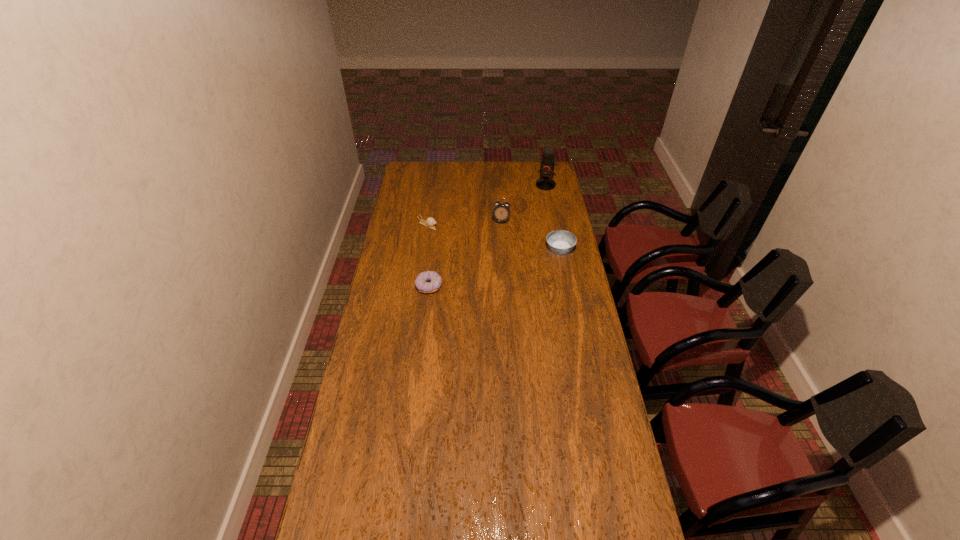
I want to click on vacant region located on the side of the farthest object with the red ring, so click(x=541, y=195).

At what (x,y) coordinates should I click in order to perform the action: click on vacant space situated 0.310m on the side of the farthest object with the red ring. Please return your answer as a coordinate pair (x, y). Looking at the image, I should click on (529, 221).

The width and height of the screenshot is (960, 540). I want to click on free spot located on the side of the farthest object with the red ring, so click(x=531, y=216).

What are the coordinates of `free point located 0.370m on the shell of the escargot` in the screenshot? It's located at (497, 255).

Find the location of `vacant area located on the shell of the escargot`. vacant area located on the shell of the escargot is located at coordinates (489, 251).

You are a GUI agent. You are given a task and a screenshot of the screen. Output one action in this format:
    pyautogui.click(x=<x>, y=<y>)
    Task: Click on the vacant space located on the shell of the escargot
    This screenshot has height=540, width=960.
    Given the screenshot: What is the action you would take?
    pyautogui.click(x=463, y=240)

In order to click on free spot located on the face of the second tallest object in this screenshot , I will do `click(494, 261)`.

Find the location of a particular element. blank space located on the face of the second tallest object is located at coordinates (492, 278).

The width and height of the screenshot is (960, 540). Find the location of `vacant space located on the face of the second tallest object`. vacant space located on the face of the second tallest object is located at coordinates (496, 248).

You are a GUI agent. You are given a task and a screenshot of the screen. Output one action in this format:
    pyautogui.click(x=<x>, y=<y>)
    Task: Click on the object that is at the far edge
    The width and height of the screenshot is (960, 540).
    Given the screenshot: What is the action you would take?
    pyautogui.click(x=547, y=162)